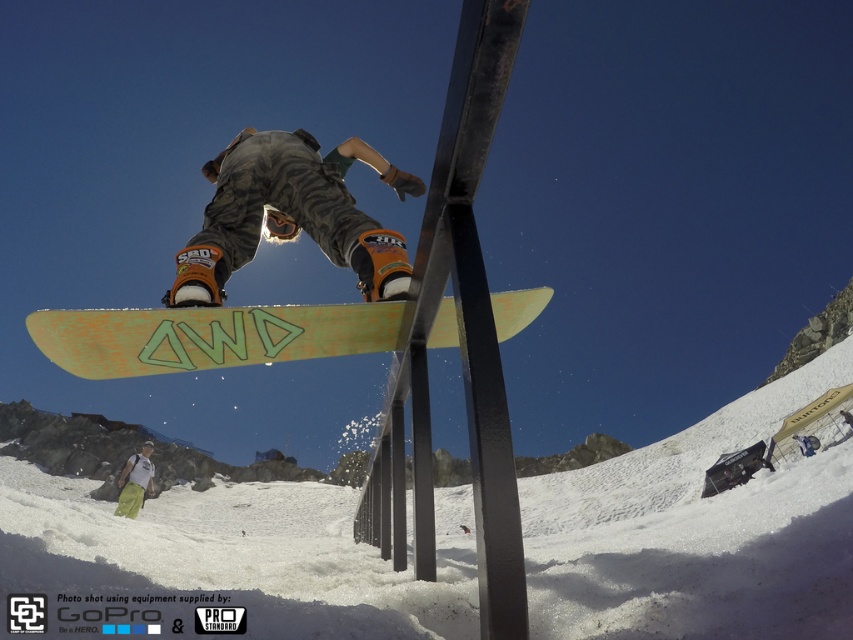
Question: Which object appears farthest from the camera in this image?

Choices:
 (A) yellow matte snowboard at center
 (B) camouflage pants at center
 (C) green matte snowboard at center

Answer: (B)

Question: Can you confirm if green matte snowboard at center is bigger than green fabric pants at lower left?

Choices:
 (A) no
 (B) yes

Answer: (A)

Question: Considering the relative positions of green matte snowboard at center and camouflage pants at center in the image provided, where is green matte snowboard at center located with respect to camouflage pants at center?

Choices:
 (A) left
 (B) right

Answer: (B)

Question: Which object is the farthest from the camouflage pants at center?

Choices:
 (A) green matte snowboard at center
 (B) yellow matte snowboard at center
 (C) green fabric pants at lower left

Answer: (C)

Question: Which point is farther to the camera?

Choices:
 (A) yellow matte snowboard at center
 (B) camouflage pants at center
 (C) green matte snowboard at center
 (D) green fabric pants at lower left

Answer: (D)

Question: Does yellow matte snowboard at center appear under green fabric pants at lower left?

Choices:
 (A) yes
 (B) no

Answer: (A)